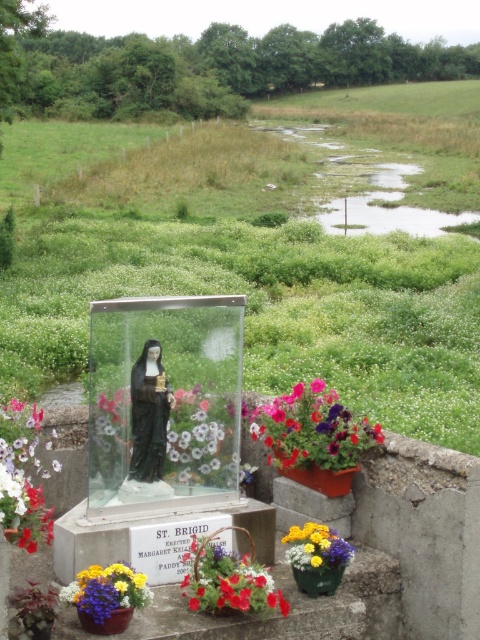
Question: Estimate the real-world distances between objects in this image. Which object is closer to the purple matte flower at center?

Choices:
 (A) multicolored fabric flowers at lower left
 (B) transparent glass statue at center
 (C) matte plastic flower at lower left
 (D) dusty pink petals at center

Answer: (D)

Question: Can you confirm if purple matte flower at center is wider than matte plastic flowers at lower center?

Choices:
 (A) no
 (B) yes

Answer: (B)

Question: In this image, where is matte plastic flower at lower left located relative to vibrant multicolored bouquet at lower center?

Choices:
 (A) left
 (B) right

Answer: (A)

Question: Which is nearer to the dusty pink petals at center?

Choices:
 (A) matte plastic flowers at lower center
 (B) vibrant multicolored bouquet at lower center
 (C) purple matte flower at center
 (D) transparent glass statue at center

Answer: (D)

Question: Which point is farther to the camera?

Choices:
 (A) matte plastic flower at lower left
 (B) purple matte flower at center

Answer: (B)

Question: Is dusty pink petals at center smaller than matte plastic flowers at lower center?

Choices:
 (A) no
 (B) yes

Answer: (B)